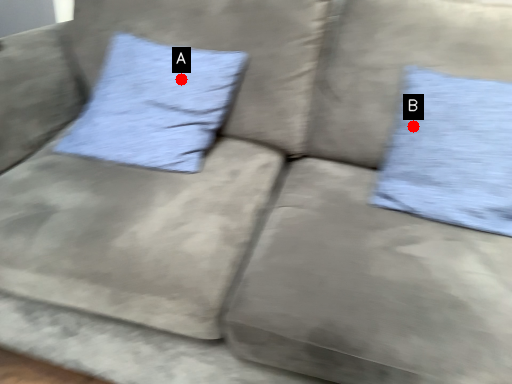
Question: Two points are circled on the image, labeled by A and B beside each circle. Which point is closer to the camera?

Choices:
 (A) A is closer
 (B) B is closer

Answer: (B)